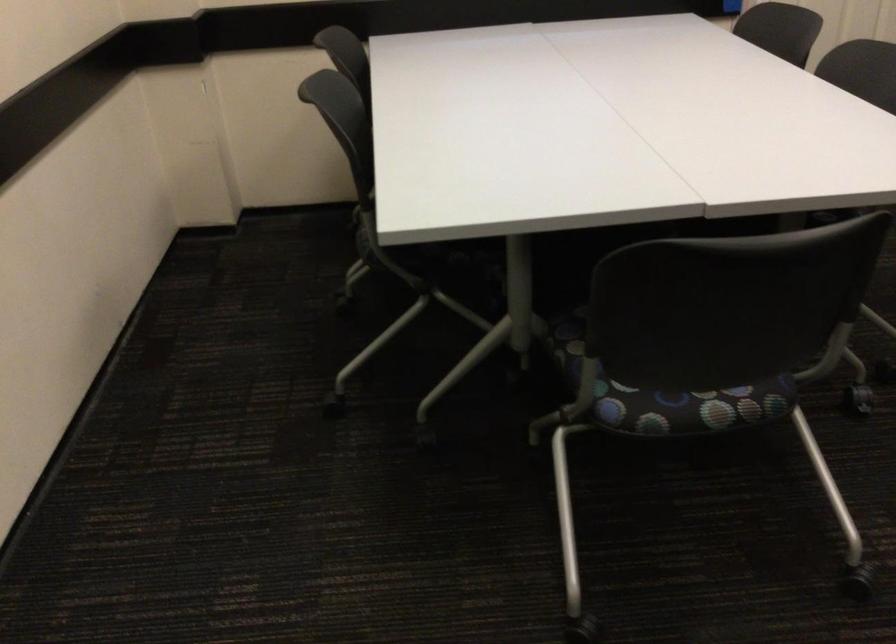
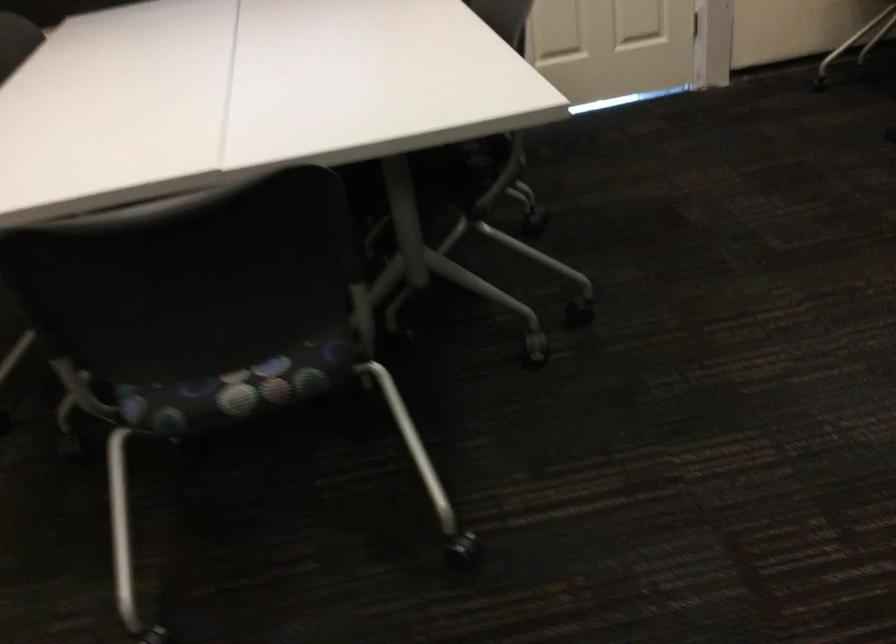
Question: The images are taken continuously from a first-person perspective. In which direction is your viewpoint rotating?

Choices:
 (A) Left
 (B) Right
 (C) Up
 (D) Down

Answer: (B)